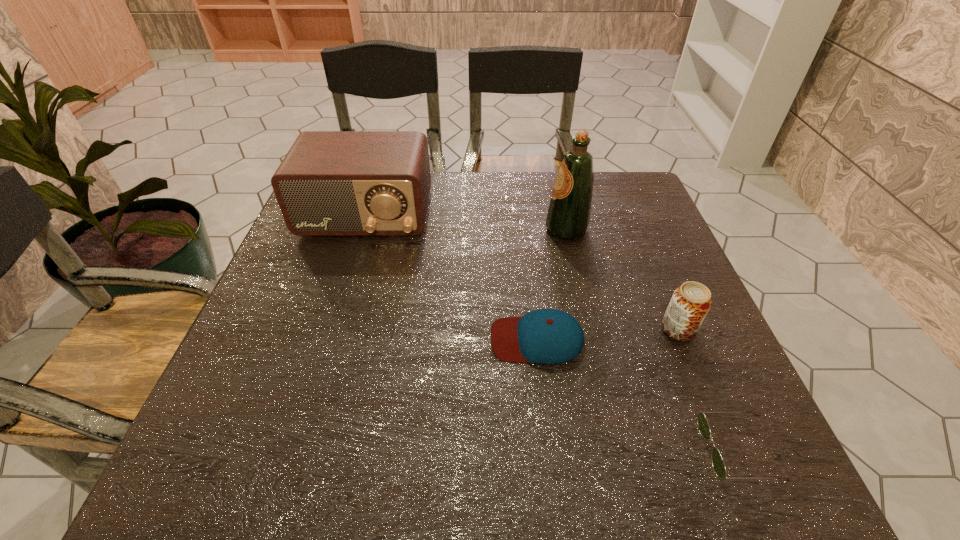
Image resolution: width=960 pixels, height=540 pixels. I want to click on object that stands as the third closest to the leftmost object, so click(x=690, y=303).

Locate an element on the screen. vacant point that satisfies the following two spatial constraints: 1. on the front-facing side of the third shortest object; 2. on the right side of the tallest object is located at coordinates (589, 329).

In order to click on free space that satisfies the following two spatial constraints: 1. on the front panel of the second tallest object; 2. on the right side of the third shortest object in this screenshot , I will do `click(330, 329)`.

Where is `free point that satisfies the following two spatial constraints: 1. on the front-facing side of the beer can; 2. on the left side of the tallest object`? This screenshot has height=540, width=960. free point that satisfies the following two spatial constraints: 1. on the front-facing side of the beer can; 2. on the left side of the tallest object is located at coordinates (589, 329).

The image size is (960, 540). Find the location of `vacant area that satisfies the following two spatial constraints: 1. on the front-facing side of the tallest object; 2. on the back side of the third shortest object`. vacant area that satisfies the following two spatial constraints: 1. on the front-facing side of the tallest object; 2. on the back side of the third shortest object is located at coordinates (589, 329).

Identify the location of free space that satisfies the following two spatial constraints: 1. on the front panel of the third shortest object; 2. on the right side of the fourth shortest object. The width and height of the screenshot is (960, 540). (330, 329).

This screenshot has width=960, height=540. Find the location of `free point that satisfies the following two spatial constraints: 1. on the back side of the third tallest object; 2. on the front-facing side of the tallest object`. free point that satisfies the following two spatial constraints: 1. on the back side of the third tallest object; 2. on the front-facing side of the tallest object is located at coordinates (636, 229).